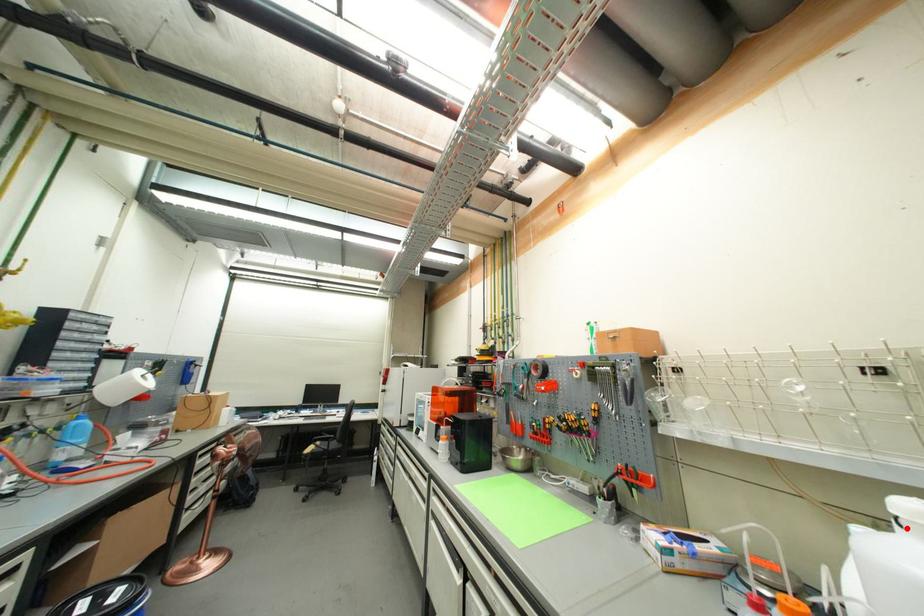
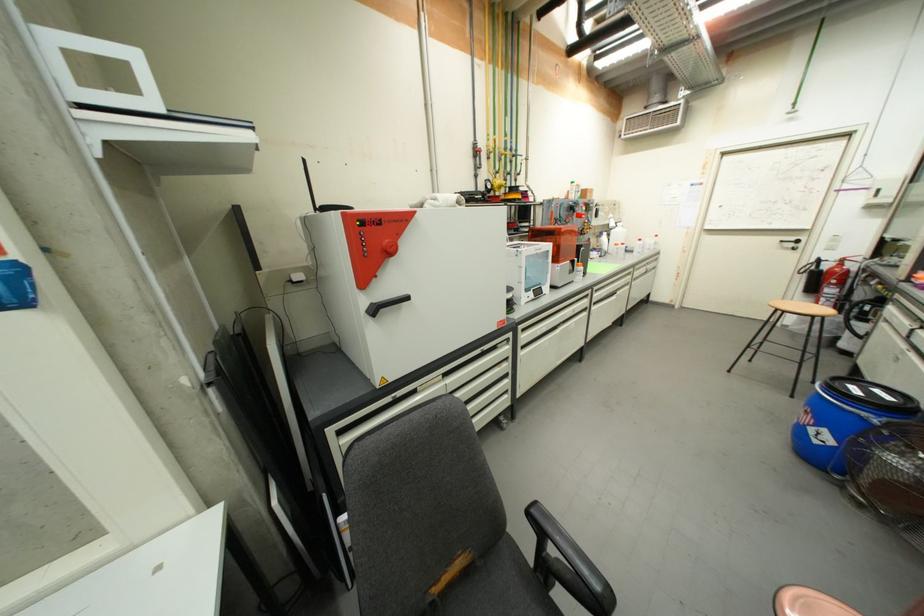
Question: I am providing you with two images of the same scene from different viewpoints. A red point is marked on the first image. Is the red point's position out of view in image 2?

Choices:
 (A) Yes
 (B) No

Answer: (A)